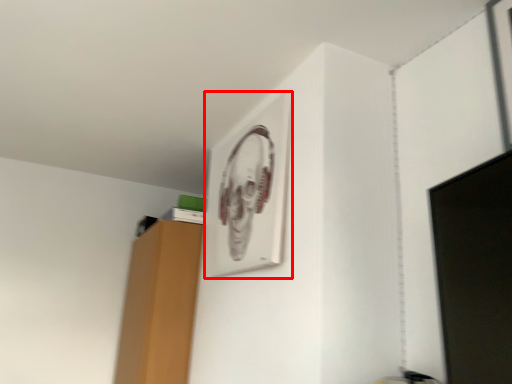
Question: From the image's perspective, where is picture frame (annotated by the red box) located in relation to computer monitor in the image?

Choices:
 (A) below
 (B) above

Answer: (B)